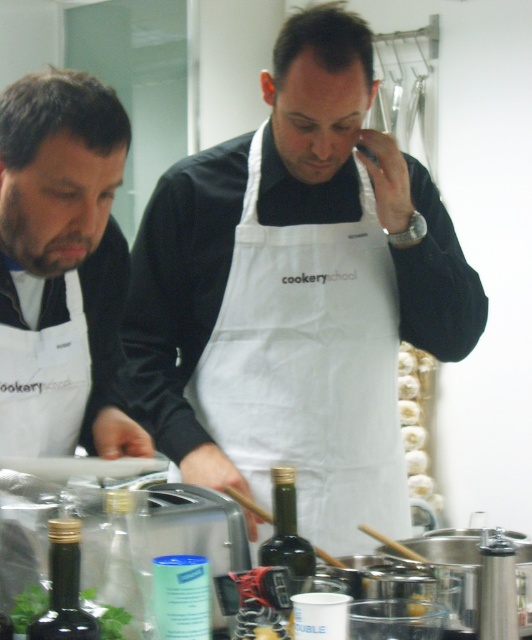
You are a chef standing in the kitchen and need to reach the white cotton apron at center to adjust its position. Can you comfortably reach it from where you are standing?

The white cotton apron at center is 1.51 meters away from the viewer, which is within a comfortable reaching distance for most people, so yes, you can comfortably reach it.

You are a chef in a cooking class. You need to grab the dark green glass bottle at lower left to add some vinegar to the dish. However, your white cotton apron at center might be in the way. Is the apron blocking your access to the bottle?

The white cotton apron at center is to the right of the dark green glass bottle at lower left, so it is positioned in a way that could be blocking your access to the bottle depending on your angle of approach. You might need to adjust your position or move the apron slightly to reach the bottle.